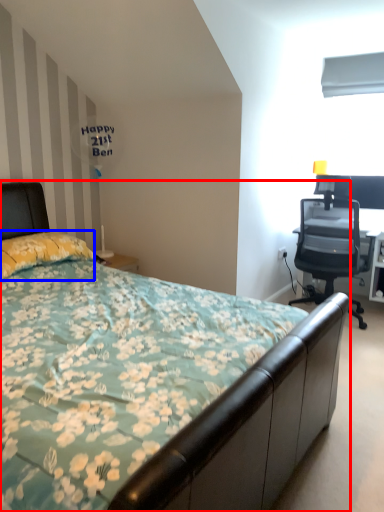
Question: Which object is further to the camera taking this photo, bed (highlighted by a red box) or pillow (highlighted by a blue box)?

Choices:
 (A) bed
 (B) pillow

Answer: (B)